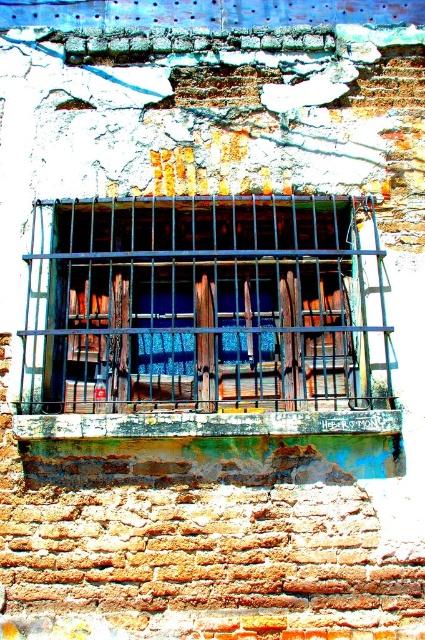
You are a window installer checking the dimensions of the window area. You have a new decorative panel that is 1 meter tall. The panel needs to fit vertically between the metallic bars at center and the rusty metal window sill at center. Can the panel fit based on their heights?

The metallic bars at center is taller than the rusty metal window sill at center, so the vertical space between them may not accommodate a 1 meter tall panel. However, without exact measurements of the distance between them, it is uncertain. The description only provides a comparison of their heights, not the actual spacing.

You are an interior designer assessing a historic building. You need to install a new decorative shelf between the metallic bars at center and the rusty metal window sill at center. Which object should the shelf be placed closer to if it needs to support heavier items?

The shelf should be placed closer to the metallic bars at center because they have a larger size and can support heavier items compared to the rusty metal window sill at center.

You are an interior designer assessing the window in the scene. The metallic bars at center and the rusty metal window sill at center are both part of the window structure. Which of these two components is wider in terms of physical dimensions?

The metallic bars at center are wider than the rusty metal window sill at center.